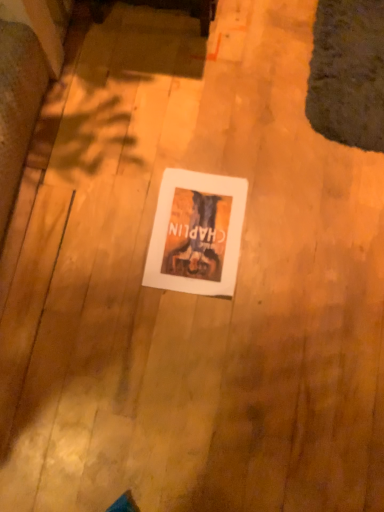
Find the location of `white paper poster at center`. white paper poster at center is located at coordinates (196, 233).

What do you see at coordinates (196, 233) in the screenshot? I see `white paper poster at center` at bounding box center [196, 233].

Find the location of a particular element. white paper poster at center is located at coordinates (196, 233).